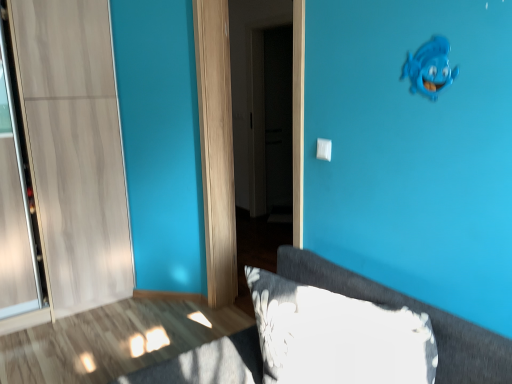
Question: Is white plastic light switch at center in front of white glossy door at center?

Choices:
 (A) yes
 (B) no

Answer: (A)

Question: Is white glossy door at center inside white plastic light switch at center?

Choices:
 (A) no
 (B) yes

Answer: (A)

Question: Does white plastic light switch at center turn towards white glossy door at center?

Choices:
 (A) yes
 (B) no

Answer: (B)

Question: Is white plastic light switch at center outside of white glossy door at center?

Choices:
 (A) yes
 (B) no

Answer: (A)

Question: Can you confirm if white plastic light switch at center is shorter than white glossy door at center?

Choices:
 (A) yes
 (B) no

Answer: (A)

Question: From a real-world perspective, is fluffy gray pillow at lower right physically located above or below blue matte fish at upper right?

Choices:
 (A) below
 (B) above

Answer: (A)

Question: Would you say fluffy gray pillow at lower right is inside or outside blue matte fish at upper right?

Choices:
 (A) outside
 (B) inside

Answer: (A)

Question: Is fluffy gray pillow at lower right taller or shorter than blue matte fish at upper right?

Choices:
 (A) short
 (B) tall

Answer: (B)

Question: Is fluffy gray pillow at lower right wider or thinner than blue matte fish at upper right?

Choices:
 (A) wide
 (B) thin

Answer: (A)

Question: Does point (324, 139) appear closer or farther from the camera than point (249, 211)?

Choices:
 (A) closer
 (B) farther

Answer: (A)

Question: Is white plastic light switch at center in front of or behind white glossy door at center in the image?

Choices:
 (A) front
 (B) behind

Answer: (A)

Question: From a real-world perspective, is white plastic light switch at center above or below white glossy door at center?

Choices:
 (A) below
 (B) above

Answer: (B)

Question: Based on their sizes in the image, would you say white plastic light switch at center is bigger or smaller than white glossy door at center?

Choices:
 (A) small
 (B) big

Answer: (A)

Question: From the image's perspective, relative to white plastic light switch at center, is fluffy gray pillow at lower right above or below?

Choices:
 (A) above
 (B) below

Answer: (B)

Question: Is point (368, 299) positioned closer to the camera than point (318, 148)?

Choices:
 (A) farther
 (B) closer

Answer: (B)